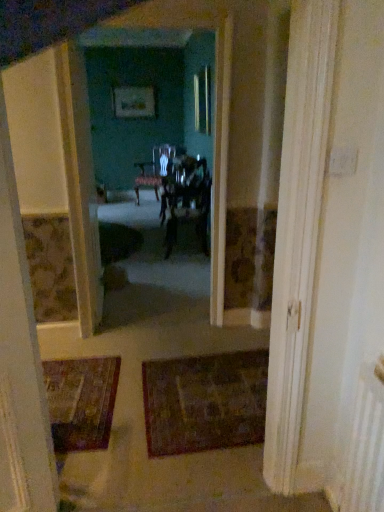
How much space does wooden glossy chair at center, which is the first chair in right-to-left order, occupy horizontally?

wooden glossy chair at center, which is the first chair in right-to-left order, is 22.81 inches wide.

You are a GUI agent. You are given a task and a screenshot of the screen. Output one action in this format:
    pyautogui.click(x=<x>, y=<y>)
    Task: Click on the wooden glossy chair at center, positioned as the 2th chair in back-to-front order
    
    Given the screenshot: What is the action you would take?
    pyautogui.click(x=189, y=202)

Locate an element on the screen. The width and height of the screenshot is (384, 512). wooden glossy chair at center, which is the first chair in right-to-left order is located at coordinates (189, 202).

Between wooden glossy chair at center, the first chair in the front-to-back sequence, and matte white door at center, which one has larger width?

wooden glossy chair at center, the first chair in the front-to-back sequence.

Between wooden glossy chair at center, which is the first chair in right-to-left order, and matte white door at center, which one is positioned behind?

wooden glossy chair at center, which is the first chair in right-to-left order, is further from the camera.

From the image's perspective, between wooden glossy chair at center, positioned as the second chair in left-to-right order, and matte white door at center, who is located below?

wooden glossy chair at center, positioned as the second chair in left-to-right order, is shown below in the image.

Who is shorter, matte white door at center or wooden glossy chair at center, the second chair viewed from the top?

Standing shorter between the two is wooden glossy chair at center, the second chair viewed from the top.

Does matte white door at center touch wooden glossy chair at center, positioned as the 2th chair in back-to-front order?

No, matte white door at center is not with wooden glossy chair at center, positioned as the 2th chair in back-to-front order.

Which is less distant, (83, 281) or (176, 211)?

Point (83, 281) is closer to the camera than point (176, 211).

Is matte white door at center looking in the opposite direction of wooden glossy chair at center, positioned as the second chair in left-to-right order?

No, matte white door at center is not facing away from wooden glossy chair at center, positioned as the second chair in left-to-right order.

How far apart are matte black chair at center, which appears as the first chair when viewed from the top, and wooden glossy chair at center, the second chair viewed from the top?

matte black chair at center, which appears as the first chair when viewed from the top, is 23.69 inches from wooden glossy chair at center, the second chair viewed from the top.

Considering the sizes of objects matte black chair at center, which is the 1th chair in back-to-front order, and wooden glossy chair at center, the second chair viewed from the top, in the image provided, who is shorter, matte black chair at center, which is the 1th chair in back-to-front order, or wooden glossy chair at center, the second chair viewed from the top,?

wooden glossy chair at center, the second chair viewed from the top.

Considering the relative positions of matte black chair at center, the second chair from the front, and wooden glossy chair at center, the first chair in the front-to-back sequence, in the image provided, is matte black chair at center, the second chair from the front, to the right of wooden glossy chair at center, the first chair in the front-to-back sequence, from the viewer's perspective?

Incorrect, matte black chair at center, the second chair from the front, is not on the right side of wooden glossy chair at center, the first chair in the front-to-back sequence.

In terms of size, does matte black chair at center, the first chair in the left-to-right sequence, appear bigger or smaller than wooden glossy chair at center, which is counted as the first chair, starting from the bottom?

Considering their sizes, matte black chair at center, the first chair in the left-to-right sequence, takes up more space than wooden glossy chair at center, which is counted as the first chair, starting from the bottom.

From a real-world perspective, between matte white door at center and dark brown textured rug at center, who is vertically lower?

dark brown textured rug at center.

Relative to dark brown textured rug at center, is matte white door at center in front or behind?

matte white door at center is positioned farther from the viewer than dark brown textured rug at center.

Considering the sizes of matte white door at center and dark brown textured rug at center in the image, is matte white door at center taller or shorter than dark brown textured rug at center?

Clearly, matte white door at center is taller compared to dark brown textured rug at center.

Considering the relative sizes of matte white door at center and dark brown textured rug at center in the image provided, is matte white door at center bigger than dark brown textured rug at center?

Indeed, matte white door at center has a larger size compared to dark brown textured rug at center.

Which is in front, matte black chair at center, the second chair from the front, or dark brown textured rug at center?

dark brown textured rug at center is in front.

From the image's perspective, is matte black chair at center, which is the 1th chair in back-to-front order, located above dark brown textured rug at center?

Indeed, from the image's perspective, matte black chair at center, which is the 1th chair in back-to-front order, is shown above dark brown textured rug at center.

In terms of height, does matte black chair at center, which appears as the first chair when viewed from the top, look taller or shorter compared to dark brown textured rug at center?

Considering their sizes, matte black chair at center, which appears as the first chair when viewed from the top, has more height than dark brown textured rug at center.

Is matte black chair at center, the second chair from the front, looking in the opposite direction of dark brown textured rug at center?

No, dark brown textured rug at center is not at the back of matte black chair at center, the second chair from the front.

Is the position of wooden glossy chair at center, positioned as the second chair in left-to-right order, less distant than that of dark brown textured rug at center?

A: No, it is not.

Is wooden glossy chair at center, positioned as the second chair in left-to-right order, spatially inside dark brown textured rug at center, or outside of it?

wooden glossy chair at center, positioned as the second chair in left-to-right order, is spatially situated outside dark brown textured rug at center.

From the image's perspective, is wooden glossy chair at center, the second chair viewed from the top, on dark brown textured rug at center?

Indeed, from the image's perspective, wooden glossy chair at center, the second chair viewed from the top, is shown above dark brown textured rug at center.

Which of these two, wooden glossy chair at center, the first chair in the front-to-back sequence, or dark brown textured rug at center, stands taller?

With more height is wooden glossy chair at center, the first chair in the front-to-back sequence.

From the image's perspective, is dark brown textured rug at center above or below matte white door at center?

Clearly, from the image's perspective, dark brown textured rug at center is below matte white door at center.

From a real-world perspective, relative to matte white door at center, is dark brown textured rug at center vertically above or below?

Clearly, from a real-world perspective, dark brown textured rug at center is below matte white door at center.

Which is nearer, (x=256, y=369) or (x=94, y=272)?

Point (x=256, y=369).

Is matte white door at center at the back of dark brown textured rug at center?

That's not correct — dark brown textured rug at center is not looking away from matte white door at center.

Locate an element on the screen. chair that is the 1st object located behind the matte white door at center is located at coordinates (189, 202).

The image size is (384, 512). What are the coordinates of `door on the left of wooden glossy chair at center, positioned as the 2th chair in back-to-front order` in the screenshot? It's located at (81, 191).

From the image, which object appears to be nearer to wooden glossy chair at center, positioned as the second chair in left-to-right order, matte white door at center or matte black chair at center, which appears as the first chair when viewed from the top?

Based on the image, matte black chair at center, which appears as the first chair when viewed from the top, appears to be nearer to wooden glossy chair at center, positioned as the second chair in left-to-right order.

From the image, which object appears to be farther from dark brown textured rug at center, matte white door at center or matte black chair at center, the first chair in the left-to-right sequence?

matte black chair at center, the first chair in the left-to-right sequence, is further to dark brown textured rug at center.

Considering their positions, is wooden glossy chair at center, positioned as the 2th chair in back-to-front order, positioned closer to matte white door at center than matte black chair at center, the second chair in the bottom-to-top sequence?

wooden glossy chair at center, positioned as the 2th chair in back-to-front order, lies closer to matte white door at center than the other object.

From the image, which object appears to be farther from matte white door at center, matte black chair at center, the second chair in the bottom-to-top sequence, or dark brown textured rug at center?

matte black chair at center, the second chair in the bottom-to-top sequence, lies further to matte white door at center than the other object.

Looking at the image, which one is located closer to dark brown textured rug at center, matte black chair at center, which is the 1th chair in back-to-front order, or matte white door at center?

Based on the image, matte white door at center appears to be nearer to dark brown textured rug at center.

From the image, which object appears to be nearer to matte black chair at center, the second chair in the bottom-to-top sequence, matte white door at center or dark brown textured rug at center?

Based on the image, matte white door at center appears to be nearer to matte black chair at center, the second chair in the bottom-to-top sequence.

From the image, which object appears to be nearer to matte white door at center, matte black chair at center, which appears as the first chair when viewed from the top, or wooden glossy chair at center, positioned as the second chair in left-to-right order?

The object closer to matte white door at center is wooden glossy chair at center, positioned as the second chair in left-to-right order.

Looking at the image, which one is located closer to dark brown textured rug at center, wooden glossy chair at center, positioned as the second chair in left-to-right order, or matte black chair at center, which appears as the first chair when viewed from the top?

wooden glossy chair at center, positioned as the second chair in left-to-right order, is positioned closer to the anchor dark brown textured rug at center.

Where is `chair between matte white door at center and matte black chair at center, which is the 1th chair in back-to-front order, along the z-axis`? chair between matte white door at center and matte black chair at center, which is the 1th chair in back-to-front order, along the z-axis is located at coordinates (189, 202).

The width and height of the screenshot is (384, 512). In order to click on door between dark brown textured rug at center and matte black chair at center, which is the 1th chair in back-to-front order, from front to back in this screenshot , I will do `click(81, 191)`.

You are a GUI agent. You are given a task and a screenshot of the screen. Output one action in this format:
    pyautogui.click(x=<x>, y=<y>)
    Task: Click on the door located between dark brown textured rug at center and wooden glossy chair at center, which is counted as the first chair, starting from the bottom, in the depth direction
    Image resolution: width=384 pixels, height=512 pixels.
    Given the screenshot: What is the action you would take?
    pyautogui.click(x=81, y=191)

In order to click on chair between dark brown textured rug at center and matte black chair at center, the 2th chair from the right, from front to back in this screenshot , I will do `click(189, 202)`.